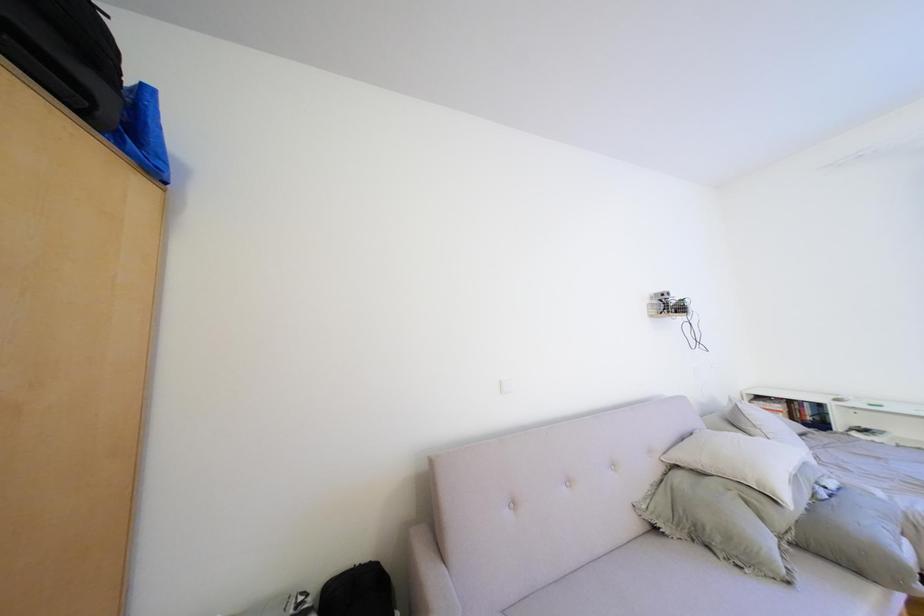
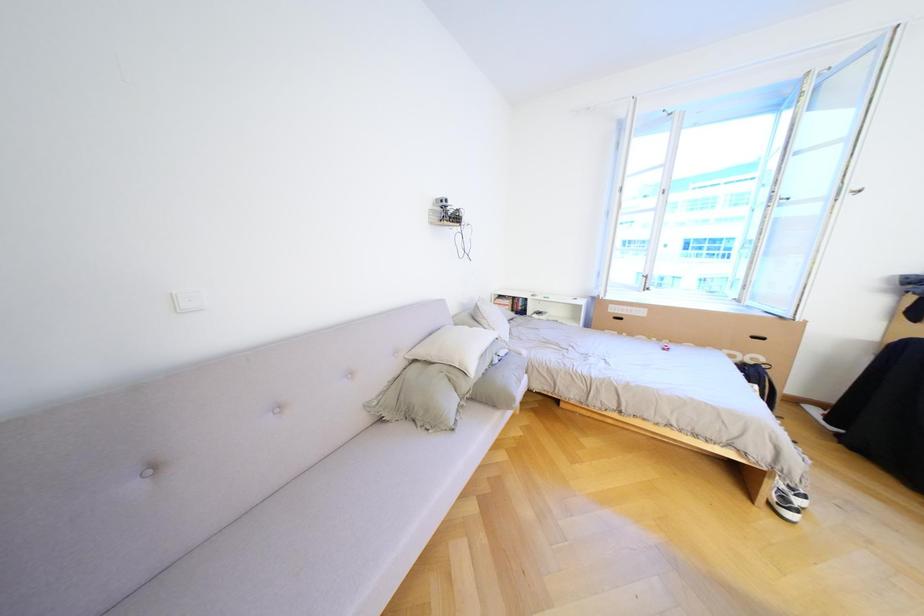
Looking at this image, first-person continuous shooting, in which direction is the camera rotating?

The camera rotated toward right-down.